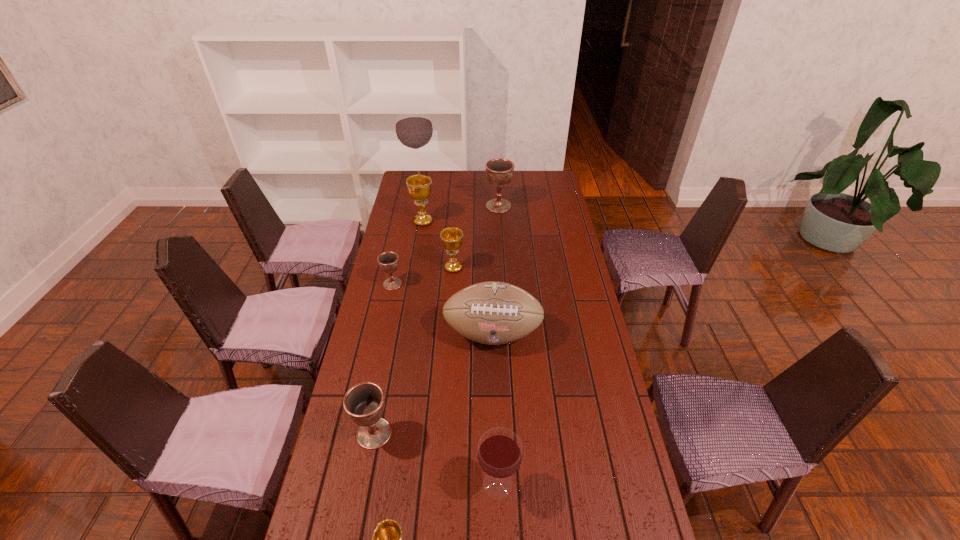
Image resolution: width=960 pixels, height=540 pixels. I want to click on the farthest object, so click(414, 129).

In order to click on alcohol in this screenshot , I will do `click(414, 129)`.

Locate an element on the screen. The image size is (960, 540). the second farthest object is located at coordinates (499, 172).

At what (x,y) coordinates should I click in order to perform the action: click on the biggest brown chalice. Please return your answer as a coordinate pair (x, y). The width and height of the screenshot is (960, 540). Looking at the image, I should click on (499, 172).

At what (x,y) coordinates should I click in order to perform the action: click on the biggest gold chalice. Please return your answer as a coordinate pair (x, y). This screenshot has height=540, width=960. Looking at the image, I should click on (419, 186).

Identify the location of the farthest gold chalice. (419, 186).

You are a GUI agent. You are given a task and a screenshot of the screen. Output one action in this format:
    pyautogui.click(x=<x>, y=<y>)
    Task: Click on the football (American)
    
    Given the screenshot: What is the action you would take?
    pyautogui.click(x=493, y=313)

Find the location of a particular element. the eighth farthest object is located at coordinates (499, 453).

The width and height of the screenshot is (960, 540). In order to click on wineglass in this screenshot , I will do `click(499, 453)`.

At what (x,y) coordinates should I click in order to perform the action: click on the second biggest gold chalice. Please return your answer as a coordinate pair (x, y). This screenshot has height=540, width=960. Looking at the image, I should click on (451, 237).